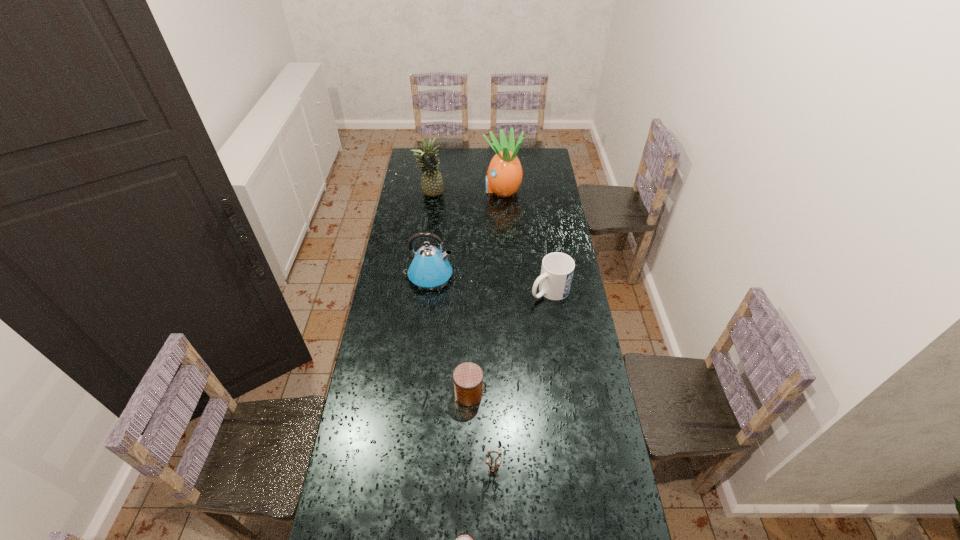
Where is `free spot that satisfies the following two spatial constraints: 1. at the entrance of the right pineapple; 2. on the front side of the candle holder`? free spot that satisfies the following two spatial constraints: 1. at the entrance of the right pineapple; 2. on the front side of the candle holder is located at coordinates (518, 471).

Where is `free spot that satisfies the following two spatial constraints: 1. on the back side of the candle holder; 2. at the spout of the fifth shortest object`? This screenshot has height=540, width=960. free spot that satisfies the following two spatial constraints: 1. on the back side of the candle holder; 2. at the spout of the fifth shortest object is located at coordinates click(490, 275).

Find the location of a particular element. The image size is (960, 540). free location that satisfies the following two spatial constraints: 1. at the entrance of the right pineapple; 2. on the front side of the candle holder is located at coordinates (518, 471).